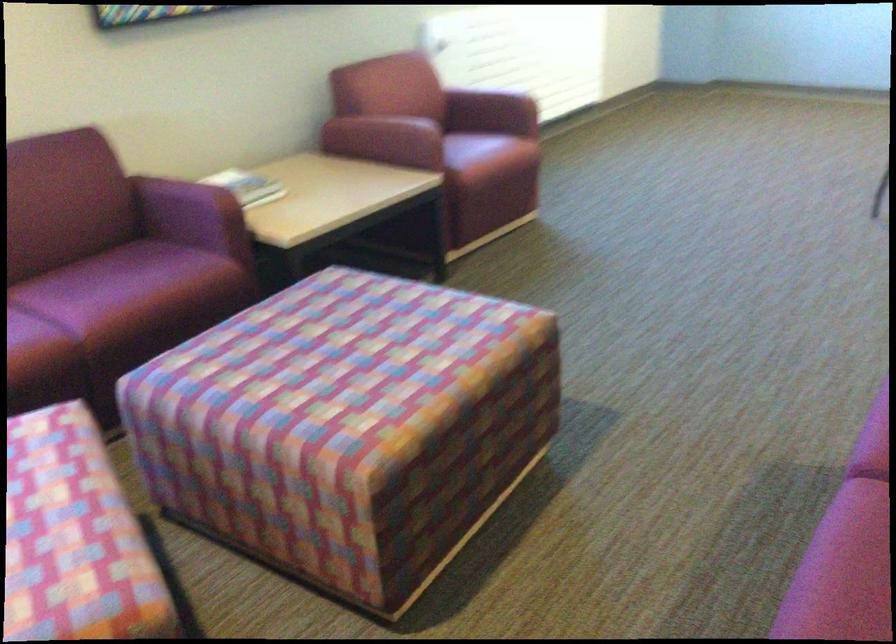
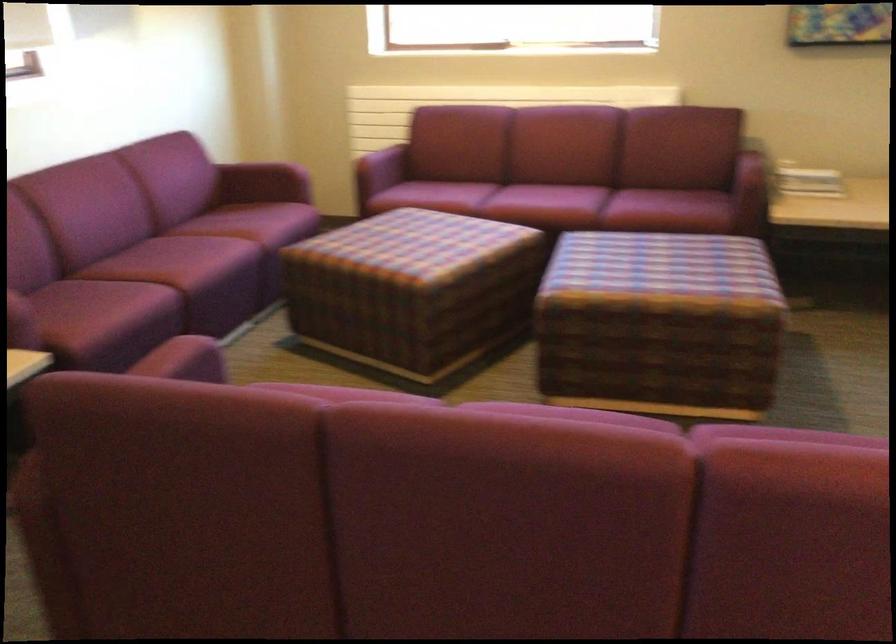
In the second image, find the point that corresponds to the point at 263,193 in the first image.

(807, 180)